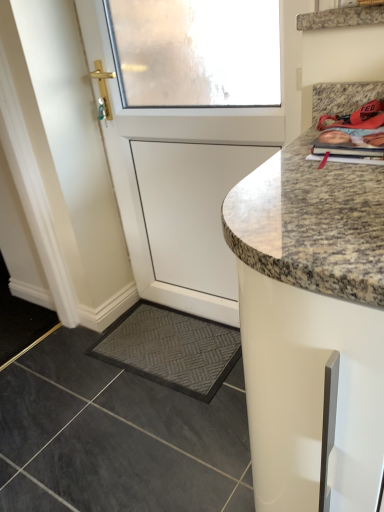
Question: Considering the relative sizes of granite at lower right and white matte door at upper left in the image provided, is granite at lower right taller than white matte door at upper left?

Choices:
 (A) yes
 (B) no

Answer: (B)

Question: Is granite at lower right in front of white matte door at upper left?

Choices:
 (A) no
 (B) yes

Answer: (B)

Question: Is granite at lower right touching white matte door at upper left?

Choices:
 (A) yes
 (B) no

Answer: (B)

Question: Is granite at lower right not within white matte door at upper left?

Choices:
 (A) no
 (B) yes

Answer: (B)

Question: Is granite at lower right at the left side of white matte door at upper left?

Choices:
 (A) no
 (B) yes

Answer: (B)

Question: Does point (200, 351) appear closer or farther from the camera than point (266, 109)?

Choices:
 (A) closer
 (B) farther

Answer: (B)

Question: Based on their positions, is dark gray textured mat at lower left located to the left or right of white matte door at upper left?

Choices:
 (A) left
 (B) right

Answer: (A)

Question: Looking at their shapes, would you say dark gray textured mat at lower left is wider or thinner than white matte door at upper left?

Choices:
 (A) wide
 (B) thin

Answer: (A)

Question: From their relative heights in the image, would you say dark gray textured mat at lower left is taller or shorter than white matte door at upper left?

Choices:
 (A) short
 (B) tall

Answer: (A)

Question: Is point (215, 441) positioned closer to the camera than point (148, 377)?

Choices:
 (A) closer
 (B) farther

Answer: (A)

Question: From a real-world perspective, is granite at lower right above or below dark gray textured mat at lower left?

Choices:
 (A) below
 (B) above

Answer: (A)

Question: In the image, is granite at lower right on the left side or the right side of dark gray textured mat at lower left?

Choices:
 (A) left
 (B) right

Answer: (A)

Question: Is granite at lower right situated inside dark gray textured mat at lower left or outside?

Choices:
 (A) inside
 (B) outside

Answer: (B)

Question: Is granite shelf at upper right to the left or to the right of dark gray textured mat at lower left in the image?

Choices:
 (A) right
 (B) left

Answer: (A)

Question: Considering the positions of granite shelf at upper right and dark gray textured mat at lower left in the image, is granite shelf at upper right wider or thinner than dark gray textured mat at lower left?

Choices:
 (A) wide
 (B) thin

Answer: (B)